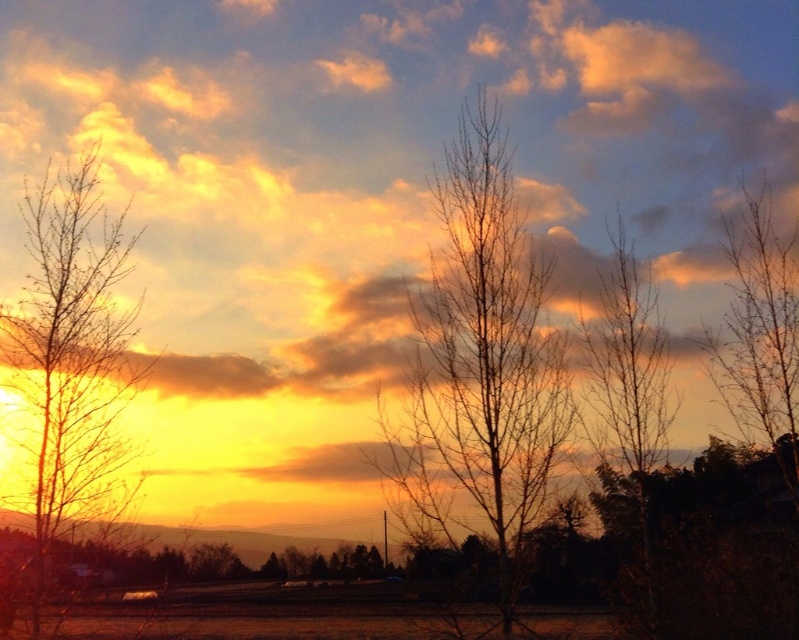
Question: Among these points, which one is farthest from the camera?

Choices:
 (A) (97, 202)
 (B) (293, 74)
 (C) (491, 228)
 (D) (650, 401)

Answer: (B)

Question: Which is nearer to the bare branches at left?

Choices:
 (A) bare branches at upper right
 (B) bare branches at center

Answer: (B)

Question: Considering the real-world distances, which object is closest to the golden/yellow cloud at upper center?

Choices:
 (A) bare branches at left
 (B) bare branches at center
 (C) bare branches at upper right

Answer: (B)

Question: Is bare branches at center positioned behind bare branches at upper right?

Choices:
 (A) no
 (B) yes

Answer: (A)

Question: Can you confirm if bare branches at left is positioned to the left of bare branches at upper right?

Choices:
 (A) yes
 (B) no

Answer: (A)

Question: Does bare branches at left appear over bare branches at upper right?

Choices:
 (A) no
 (B) yes

Answer: (B)